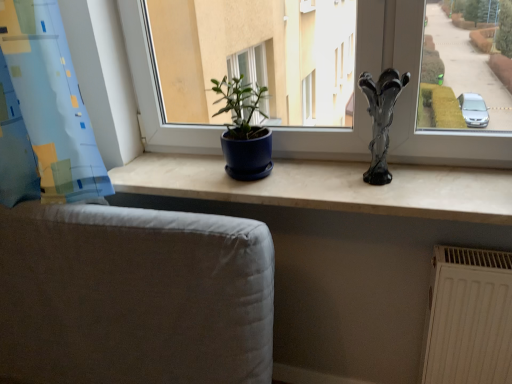
Question: From the image's perspective, would you say matte blue pot at center is positioned over white textured radiator at lower right?

Choices:
 (A) no
 (B) yes

Answer: (B)

Question: Is matte blue pot at center closer to camera compared to white textured radiator at lower right?

Choices:
 (A) no
 (B) yes

Answer: (A)

Question: From a real-world perspective, does matte blue pot at center sit lower than white textured radiator at lower right?

Choices:
 (A) yes
 (B) no

Answer: (B)

Question: Does matte blue pot at center have a greater width compared to white textured radiator at lower right?

Choices:
 (A) yes
 (B) no

Answer: (A)

Question: Can you confirm if matte blue pot at center is bigger than white textured radiator at lower right?

Choices:
 (A) no
 (B) yes

Answer: (A)

Question: Considering the positions of matte blue pot at center and white textured radiator at lower right in the image, is matte blue pot at center wider or thinner than white textured radiator at lower right?

Choices:
 (A) thin
 (B) wide

Answer: (A)

Question: In the image, is matte blue pot at center positioned in front of or behind white textured radiator at lower right?

Choices:
 (A) front
 (B) behind

Answer: (A)

Question: Do you think matte blue pot at center is within white textured radiator at lower right, or outside of it?

Choices:
 (A) inside
 (B) outside

Answer: (B)

Question: Is point (479, 152) positioned closer to the camera than point (470, 301)?

Choices:
 (A) farther
 (B) closer

Answer: (A)

Question: Is matte blue pot at center in front of or behind matte blue pot at center in the image?

Choices:
 (A) front
 (B) behind

Answer: (A)

Question: Is matte blue pot at center inside the boundaries of matte blue pot at center, or outside?

Choices:
 (A) outside
 (B) inside

Answer: (A)

Question: From a real-world perspective, is matte blue pot at center positioned above or below matte blue pot at center?

Choices:
 (A) above
 (B) below

Answer: (A)

Question: Looking at their shapes, would you say matte blue pot at center is wider or thinner than matte blue pot at center?

Choices:
 (A) thin
 (B) wide

Answer: (A)

Question: Is transparent glass vase at right bigger or smaller than blue fabric curtain at left?

Choices:
 (A) big
 (B) small

Answer: (B)

Question: From the image's perspective, is transparent glass vase at right positioned above or below blue fabric curtain at left?

Choices:
 (A) above
 (B) below

Answer: (B)